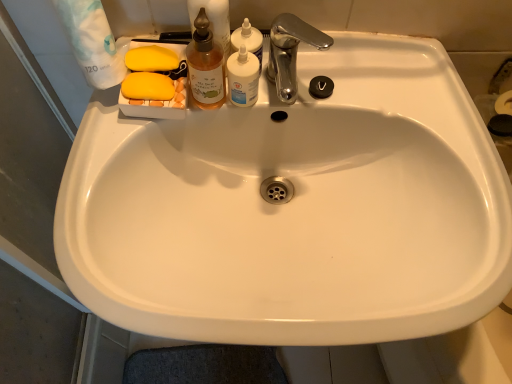
Find the location of a particular element. chrome metallic faucet at upper center is located at coordinates (290, 52).

Looking at this image, what is the approximate height of translucent glass bottle at upper center, which appears as the 1th cleaning product when viewed from the left?

The height of translucent glass bottle at upper center, which appears as the 1th cleaning product when viewed from the left, is 5.79 inches.

Where is `white opaque bottle at upper center`? white opaque bottle at upper center is located at coordinates (243, 77).

Image resolution: width=512 pixels, height=384 pixels. Identify the location of translucent plastic bottle at upper center, the 1th cleaning product positioned from the right. (248, 40).

Where is `chrome metallic faucet at upper center`? This screenshot has height=384, width=512. chrome metallic faucet at upper center is located at coordinates (x=290, y=52).

From a real-world perspective, relative to white opaque bottle at upper center, is translucent glass bottle at upper center, which appears as the 1th cleaning product when viewed from the left, vertically above or below?

translucent glass bottle at upper center, which appears as the 1th cleaning product when viewed from the left, is above white opaque bottle at upper center.

Can you confirm if translucent glass bottle at upper center, which appears as the 1th cleaning product when viewed from the left, is smaller than white opaque bottle at upper center?

Actually, translucent glass bottle at upper center, which appears as the 1th cleaning product when viewed from the left, might be larger than white opaque bottle at upper center.

Is translucent glass bottle at upper center, the 2th cleaning product positioned from the right, turned away from white opaque bottle at upper center?

No, translucent glass bottle at upper center, the 2th cleaning product positioned from the right, is not facing away from white opaque bottle at upper center.

Does translucent glass bottle at upper center, the 2th cleaning product positioned from the right, have a greater height compared to white opaque bottle at upper center?

Yes, translucent glass bottle at upper center, the 2th cleaning product positioned from the right, is taller than white opaque bottle at upper center.

Can you confirm if translucent glass bottle at upper center, the 2th cleaning product positioned from the right, is wider than chrome metallic faucet at upper center?

No.

Is translucent glass bottle at upper center, the 2th cleaning product positioned from the right, positioned with its back to chrome metallic faucet at upper center?

translucent glass bottle at upper center, the 2th cleaning product positioned from the right, does not have its back to chrome metallic faucet at upper center.

Is translucent glass bottle at upper center, the 2th cleaning product positioned from the right, in front of or behind chrome metallic faucet at upper center in the image?

translucent glass bottle at upper center, the 2th cleaning product positioned from the right, is positioned closer to the viewer than chrome metallic faucet at upper center.

Between point (215, 47) and point (323, 49), which one is positioned in front?

Point (215, 47)

Can you tell me how much white opaque bottle at upper center and translucent plastic bottle at upper center, the 1th cleaning product positioned from the right, differ in facing direction?

white opaque bottle at upper center and translucent plastic bottle at upper center, the 1th cleaning product positioned from the right, are facing 0.000638 degrees away from each other.

Is white opaque bottle at upper center aimed at translucent plastic bottle at upper center, the second cleaning product from the left?

Yes.

Is white opaque bottle at upper center with translucent plastic bottle at upper center, the 1th cleaning product positioned from the right?

Yes, the surface of white opaque bottle at upper center is in contact with translucent plastic bottle at upper center, the 1th cleaning product positioned from the right.

Looking at this image, is translucent plastic bottle at upper center, the 1th cleaning product positioned from the right, next to white opaque bottle at upper center and touching it?

Indeed, translucent plastic bottle at upper center, the 1th cleaning product positioned from the right, and white opaque bottle at upper center are beside each other and touching.

Looking at this image, could white opaque bottle at upper center be considered to be inside translucent plastic bottle at upper center, the 1th cleaning product positioned from the right?

No, white opaque bottle at upper center is not inside translucent plastic bottle at upper center, the 1th cleaning product positioned from the right.

Considering the sizes of objects translucent plastic bottle at upper center, the second cleaning product from the left, and white opaque bottle at upper center in the image provided, who is wider, translucent plastic bottle at upper center, the second cleaning product from the left, or white opaque bottle at upper center?

With larger width is translucent plastic bottle at upper center, the second cleaning product from the left.

You are a GUI agent. You are given a task and a screenshot of the screen. Output one action in this format:
    pyautogui.click(x=<x>, y=<y>)
    Task: Click on the cleaning product below the white opaque bottle at upper center (from a real-world perspective)
    
    Given the screenshot: What is the action you would take?
    pyautogui.click(x=248, y=40)

Is the position of translucent glass bottle at upper center, which appears as the 1th cleaning product when viewed from the left, less distant than that of translucent plastic bottle at upper center, the second cleaning product from the left?

Yes, translucent glass bottle at upper center, which appears as the 1th cleaning product when viewed from the left, is closer to the viewer.

In terms of width, does translucent glass bottle at upper center, the 2th cleaning product positioned from the right, look wider or thinner when compared to translucent plastic bottle at upper center, the second cleaning product from the left?

Considering their sizes, translucent glass bottle at upper center, the 2th cleaning product positioned from the right, looks slimmer than translucent plastic bottle at upper center, the second cleaning product from the left.

Which is behind, point (216, 69) or point (248, 46)?

The point (248, 46) is behind.

Choose the correct answer: Is translucent glass bottle at upper center, which appears as the 1th cleaning product when viewed from the left, inside translucent plastic bottle at upper center, the 1th cleaning product positioned from the right, or outside it?

translucent glass bottle at upper center, which appears as the 1th cleaning product when viewed from the left, cannot be found inside translucent plastic bottle at upper center, the 1th cleaning product positioned from the right.

Measure the distance from translucent plastic bottle at upper center, the 1th cleaning product positioned from the right, to chrome metallic faucet at upper center.

The distance of translucent plastic bottle at upper center, the 1th cleaning product positioned from the right, from chrome metallic faucet at upper center is 2.22 inches.

In the scene shown: From a real-world perspective, between translucent plastic bottle at upper center, the 1th cleaning product positioned from the right, and chrome metallic faucet at upper center, who is vertically lower?

In real-world perspective, translucent plastic bottle at upper center, the 1th cleaning product positioned from the right, is lower.

Is translucent plastic bottle at upper center, the 1th cleaning product positioned from the right, looking in the opposite direction of chrome metallic faucet at upper center?

translucent plastic bottle at upper center, the 1th cleaning product positioned from the right, does not have its back to chrome metallic faucet at upper center.

Which is more to the left, translucent plastic bottle at upper center, the second cleaning product from the left, or chrome metallic faucet at upper center?

Positioned to the left is translucent plastic bottle at upper center, the second cleaning product from the left.

Visually, is chrome metallic faucet at upper center positioned to the left or to the right of translucent glass bottle at upper center, which appears as the 1th cleaning product when viewed from the left?

chrome metallic faucet at upper center is positioned on translucent glass bottle at upper center, which appears as the 1th cleaning product when viewed from the left,'s right side.

Is there a large distance between chrome metallic faucet at upper center and translucent glass bottle at upper center, the 2th cleaning product positioned from the right?

No.

Does point (279, 90) come farther from viewer compared to point (216, 102)?

Yes, point (279, 90) is farther from viewer.

Choose the correct answer: Is chrome metallic faucet at upper center inside translucent glass bottle at upper center, the 2th cleaning product positioned from the right, or outside it?

chrome metallic faucet at upper center exists outside the volume of translucent glass bottle at upper center, the 2th cleaning product positioned from the right.

I want to click on toiletry that appears behind the translucent glass bottle at upper center, the 2th cleaning product positioned from the right, so click(243, 77).

The height and width of the screenshot is (384, 512). I want to click on tap above the translucent glass bottle at upper center, which appears as the 1th cleaning product when viewed from the left (from the image's perspective), so click(x=290, y=52).

From the image, which object appears to be nearer to translucent glass bottle at upper center, the 2th cleaning product positioned from the right, white opaque bottle at upper center or chrome metallic faucet at upper center?

Among the two, white opaque bottle at upper center is located nearer to translucent glass bottle at upper center, the 2th cleaning product positioned from the right.

Based on their spatial positions, is translucent plastic bottle at upper center, the 1th cleaning product positioned from the right, or white opaque bottle at upper center further from chrome metallic faucet at upper center?

Based on the image, white opaque bottle at upper center appears to be further to chrome metallic faucet at upper center.

Considering their positions, is translucent plastic bottle at upper center, the second cleaning product from the left, positioned closer to white opaque bottle at upper center than chrome metallic faucet at upper center?

translucent plastic bottle at upper center, the second cleaning product from the left, lies closer to white opaque bottle at upper center than the other object.

Considering their positions, is chrome metallic faucet at upper center positioned further to translucent plastic bottle at upper center, the second cleaning product from the left, than white opaque bottle at upper center?

Among the two, chrome metallic faucet at upper center is located further to translucent plastic bottle at upper center, the second cleaning product from the left.

Considering their positions, is translucent plastic bottle at upper center, the 1th cleaning product positioned from the right, positioned further to translucent glass bottle at upper center, which appears as the 1th cleaning product when viewed from the left, than chrome metallic faucet at upper center?

The object further to translucent glass bottle at upper center, which appears as the 1th cleaning product when viewed from the left, is chrome metallic faucet at upper center.

Which object lies nearer to the anchor point translucent glass bottle at upper center, which appears as the 1th cleaning product when viewed from the left, white opaque bottle at upper center or translucent plastic bottle at upper center, the 1th cleaning product positioned from the right?

white opaque bottle at upper center.

Estimate the real-world distances between objects in this image. Which object is closer to chrome metallic faucet at upper center, white opaque bottle at upper center or translucent plastic bottle at upper center, the 1th cleaning product positioned from the right?

translucent plastic bottle at upper center, the 1th cleaning product positioned from the right.

When comparing their distances from chrome metallic faucet at upper center, does white opaque bottle at upper center or translucent glass bottle at upper center, which appears as the 1th cleaning product when viewed from the left, seem further?

Among the two, translucent glass bottle at upper center, which appears as the 1th cleaning product when viewed from the left, is located further to chrome metallic faucet at upper center.

Identify the location of cleaning product situated between translucent glass bottle at upper center, the 2th cleaning product positioned from the right, and chrome metallic faucet at upper center from left to right. This screenshot has width=512, height=384. (248, 40).

Identify the location of cleaning product between white opaque bottle at upper center and chrome metallic faucet at upper center from left to right. (248, 40).

Identify the location of toiletry between translucent glass bottle at upper center, which appears as the 1th cleaning product when viewed from the left, and chrome metallic faucet at upper center. pyautogui.click(x=243, y=77).

What are the coordinates of `toiletry positioned between translucent glass bottle at upper center, which appears as the 1th cleaning product when viewed from the left, and translucent plastic bottle at upper center, the 1th cleaning product positioned from the right, from near to far` in the screenshot? It's located at pos(243,77).